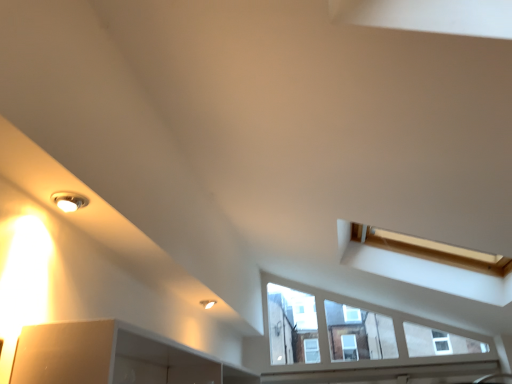
Question: Does matte silver light fixture at upper left, which is counted as the first light fixture, starting from the left, have a lesser width compared to matte white light fixture at upper left, which ranks as the 1th light fixture in right-to-left order?

Choices:
 (A) yes
 (B) no

Answer: (A)

Question: Is the surface of matte silver light fixture at upper left, which ranks as the 2th light fixture in back-to-front order, in direct contact with matte white light fixture at upper left, placed as the 2th light fixture when sorted from top to bottom?

Choices:
 (A) no
 (B) yes

Answer: (A)

Question: Is matte silver light fixture at upper left, marked as the 1th light fixture in a top-to-bottom arrangement, positioned far away from matte white light fixture at upper left, which ranks as the 1th light fixture in right-to-left order?

Choices:
 (A) no
 (B) yes

Answer: (B)

Question: Does matte silver light fixture at upper left, arranged as the 2th light fixture when viewed from the right, have a smaller size compared to matte white light fixture at upper left, the second light fixture viewed from the left?

Choices:
 (A) yes
 (B) no

Answer: (A)

Question: Is matte silver light fixture at upper left, which is counted as the first light fixture, starting from the left, positioned with its back to matte white light fixture at upper left, the first light fixture ordered from the bottom?

Choices:
 (A) yes
 (B) no

Answer: (B)

Question: Is matte white light fixture at upper left, arranged as the 1th light fixture when viewed from the back, inside or outside of matte silver light fixture at upper left, the second light fixture when ordered from bottom to top?

Choices:
 (A) inside
 (B) outside

Answer: (B)

Question: Considering the positions of matte white light fixture at upper left, the second light fixture viewed from the left, and matte silver light fixture at upper left, marked as the 1th light fixture in a top-to-bottom arrangement, in the image, is matte white light fixture at upper left, the second light fixture viewed from the left, taller or shorter than matte silver light fixture at upper left, marked as the 1th light fixture in a top-to-bottom arrangement,?

Choices:
 (A) tall
 (B) short

Answer: (A)

Question: Considering their positions, is matte white light fixture at upper left, acting as the second light fixture starting from the front, located in front of or behind matte silver light fixture at upper left, marked as the 1th light fixture in a front-to-back arrangement?

Choices:
 (A) front
 (B) behind

Answer: (B)

Question: From the image's perspective, is matte white light fixture at upper left, the first light fixture ordered from the bottom, positioned above or below matte silver light fixture at upper left, arranged as the 2th light fixture when viewed from the right?

Choices:
 (A) below
 (B) above

Answer: (A)

Question: From the image's perspective, is white painted wood at lower center located above or below matte silver light fixture at upper left, which is counted as the first light fixture, starting from the left?

Choices:
 (A) above
 (B) below

Answer: (B)

Question: Looking at their shapes, would you say white painted wood at lower center is wider or thinner than matte silver light fixture at upper left, which ranks as the 2th light fixture in back-to-front order?

Choices:
 (A) wide
 (B) thin

Answer: (B)

Question: In the image, is white painted wood at lower center positioned in front of or behind matte silver light fixture at upper left, marked as the 1th light fixture in a front-to-back arrangement?

Choices:
 (A) front
 (B) behind

Answer: (B)

Question: Considering the positions of white painted wood at lower center and matte silver light fixture at upper left, marked as the 1th light fixture in a top-to-bottom arrangement, in the image, is white painted wood at lower center bigger or smaller than matte silver light fixture at upper left, marked as the 1th light fixture in a top-to-bottom arrangement,?

Choices:
 (A) small
 (B) big

Answer: (B)

Question: Is point (211, 301) closer or farther from the camera than point (480, 370)?

Choices:
 (A) closer
 (B) farther

Answer: (A)

Question: Considering the relative positions of matte white light fixture at upper left, the first light fixture ordered from the bottom, and white painted wood at lower center in the image provided, is matte white light fixture at upper left, the first light fixture ordered from the bottom, to the left or to the right of white painted wood at lower center?

Choices:
 (A) left
 (B) right

Answer: (A)